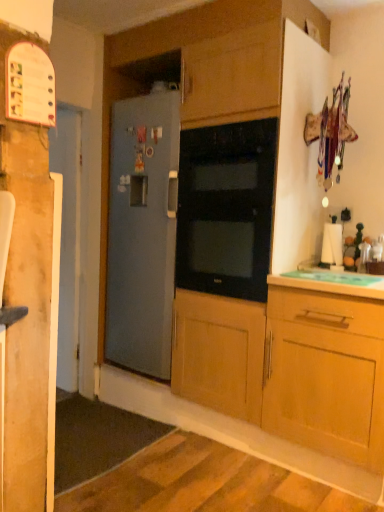
Question: Is green plastic cutting board at lower right facing towards black glass oven at center?

Choices:
 (A) no
 (B) yes

Answer: (A)

Question: Can you see green plastic cutting board at lower right touching black glass oven at center?

Choices:
 (A) no
 (B) yes

Answer: (A)

Question: From a real-world perspective, is green plastic cutting board at lower right located beneath black glass oven at center?

Choices:
 (A) yes
 (B) no

Answer: (A)

Question: Is the depth of green plastic cutting board at lower right greater than that of black glass oven at center?

Choices:
 (A) yes
 (B) no

Answer: (B)

Question: Is green plastic cutting board at lower right surrounding black glass oven at center?

Choices:
 (A) yes
 (B) no

Answer: (B)

Question: Is green plastic cutting board at lower right outside of black glass oven at center?

Choices:
 (A) yes
 (B) no

Answer: (A)

Question: Does satin gray refrigerator at center turn towards green plastic cutting board at lower right?

Choices:
 (A) yes
 (B) no

Answer: (B)

Question: Is satin gray refrigerator at center beside green plastic cutting board at lower right?

Choices:
 (A) no
 (B) yes

Answer: (A)

Question: Can you confirm if satin gray refrigerator at center is bigger than green plastic cutting board at lower right?

Choices:
 (A) yes
 (B) no

Answer: (A)

Question: Is satin gray refrigerator at center facing away from green plastic cutting board at lower right?

Choices:
 (A) no
 (B) yes

Answer: (A)

Question: Is satin gray refrigerator at center far away from green plastic cutting board at lower right?

Choices:
 (A) no
 (B) yes

Answer: (A)

Question: Does satin gray refrigerator at center lie behind green plastic cutting board at lower right?

Choices:
 (A) yes
 (B) no

Answer: (A)

Question: From the image's perspective, is black glass oven at center located above green plastic cutting board at lower right?

Choices:
 (A) no
 (B) yes

Answer: (B)